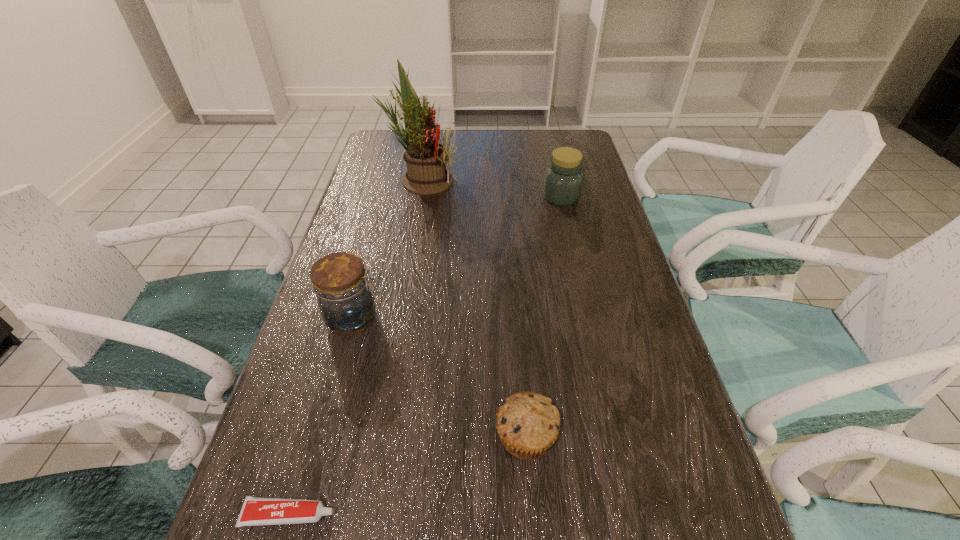
The height and width of the screenshot is (540, 960). In order to click on object that is the fourth nearest to the tallest object in this screenshot , I will do pos(255,511).

Locate which object ranks fourth in proximity to the tallest object. Please provide its 2D coordinates. Your answer should be formatted as a tuple, i.e. [(x, y)], where the tuple contains the x and y coordinates of a point satisfying the conditions above.

[(255, 511)]

I want to click on free space that satisfies the following two spatial constraints: 1. on the lid of the nearer jar; 2. on the back side of the second nearest object, so click(x=323, y=436).

Identify the location of blank space that satisfies the following two spatial constraints: 1. in front of the tallest object with the fan visible; 2. on the right side of the farther jar. (419, 197).

Identify the location of vacant space that satisfies the following two spatial constraints: 1. on the lid of the third farthest object; 2. on the left side of the fourth tallest object. (323, 436).

Image resolution: width=960 pixels, height=540 pixels. I want to click on vacant area in the image that satisfies the following two spatial constraints: 1. on the back side of the second object from right to left; 2. on the lid of the third nearest object, so click(516, 319).

Where is `vacant point that satisfies the following two spatial constraints: 1. in front of the rightmost object with the fan visible; 2. on the right side of the tallest object`? The image size is (960, 540). vacant point that satisfies the following two spatial constraints: 1. in front of the rightmost object with the fan visible; 2. on the right side of the tallest object is located at coordinates (419, 197).

Find the location of a particular element. free spot that satisfies the following two spatial constraints: 1. in front of the right jar with the fan visible; 2. on the left side of the flower arrangement is located at coordinates (419, 197).

Find the location of `free spot that satisfies the following two spatial constraints: 1. on the lid of the third nearest object; 2. on the right side of the muffin`. free spot that satisfies the following two spatial constraints: 1. on the lid of the third nearest object; 2. on the right side of the muffin is located at coordinates (323, 436).